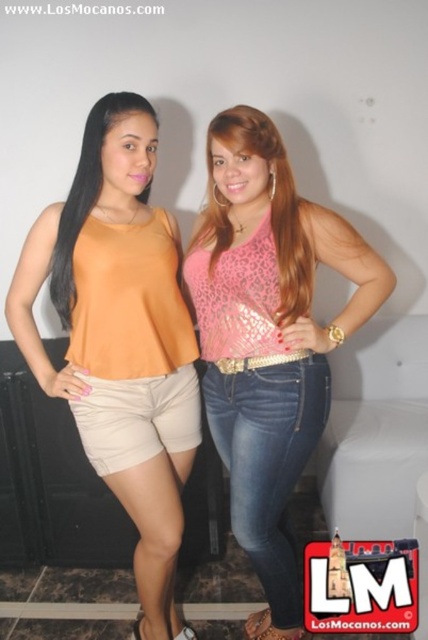
The height and width of the screenshot is (640, 428). Describe the element at coordinates (121, 339) in the screenshot. I see `matte orange tank top at left` at that location.

Which is more to the left, matte orange tank top at left or pink sequined top at center?

matte orange tank top at left is more to the left.

Where is `matte orange tank top at left`? The height and width of the screenshot is (640, 428). matte orange tank top at left is located at coordinates (121, 339).

Identify the location of matte orange tank top at left. (121, 339).